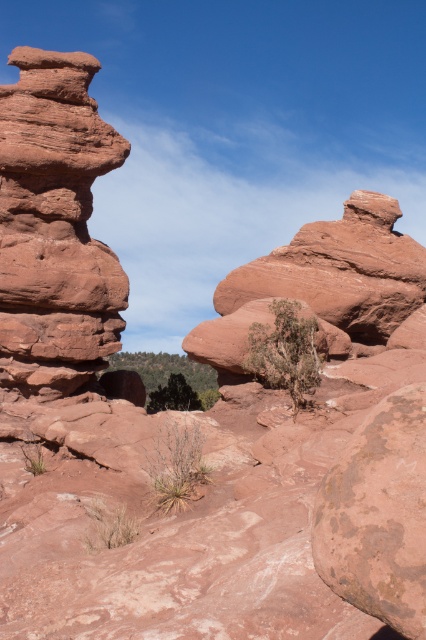
Question: Does rustic sandstone rock at center have a larger size compared to rusty stone boulder at center?

Choices:
 (A) yes
 (B) no

Answer: (A)

Question: Which of the following is the farthest from the observer?

Choices:
 (A) rusty stone boulder at center
 (B) rustic sandstone rock at center

Answer: (B)

Question: Among these objects, which one is farthest from the camera?

Choices:
 (A) rusty stone boulder at center
 (B) rustic sandstone rock at center

Answer: (B)

Question: Which point is farther to the camera?

Choices:
 (A) (383, 268)
 (B) (376, 490)

Answer: (A)

Question: Is rustic sandstone rock at center smaller than rusty stone boulder at center?

Choices:
 (A) yes
 (B) no

Answer: (B)

Question: Is rustic sandstone rock at center behind rusty stone boulder at center?

Choices:
 (A) yes
 (B) no

Answer: (A)